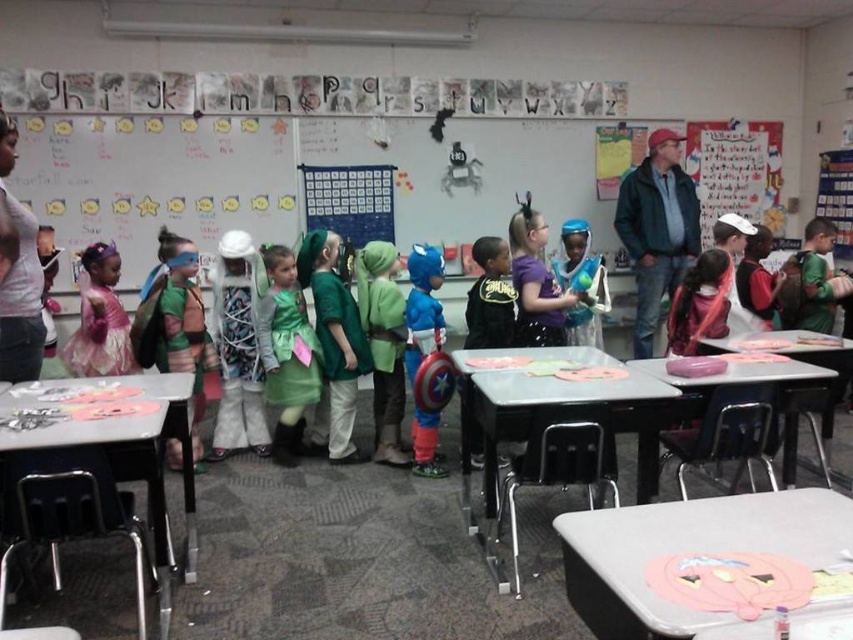
Question: Estimate the real-world distances between objects in this image. Which object is farther from the white plastic table at lower right?

Choices:
 (A) metallic gray table at lower left
 (B) denim jacket at right
 (C) pink fabric shirt at left
 (D) green felt cape at center

Answer: (B)

Question: Which of the following is the farthest from the observer?

Choices:
 (A) (316, 410)
 (B) (641, 400)
 (C) (10, 300)
 (D) (381, 339)

Answer: (A)

Question: Does white plastic table at lower right have a smaller size compared to metallic gray table at lower left?

Choices:
 (A) no
 (B) yes

Answer: (B)

Question: Can you confirm if denim jacket at right is smaller than black matte superhero costume at center?

Choices:
 (A) yes
 (B) no

Answer: (B)

Question: Is smooth plastic table at center thinner than shiny blue helmet at center?

Choices:
 (A) yes
 (B) no

Answer: (B)

Question: Among these objects, which one is farthest from the camera?

Choices:
 (A) pink satin dress at left
 (B) green fabric costume at center
 (C) shiny blue helmet at center

Answer: (C)